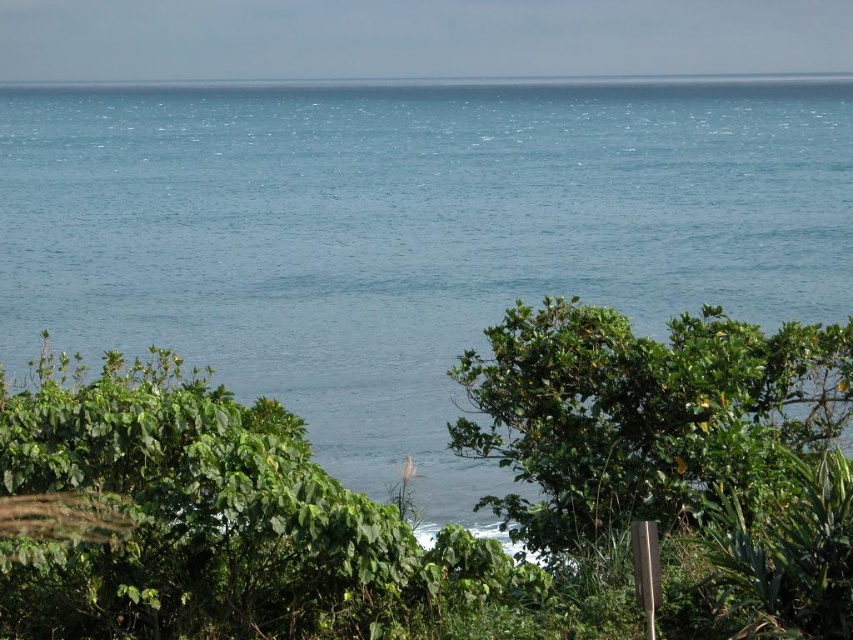
Question: Can you confirm if blue water at center is positioned above green leafy tree at center?

Choices:
 (A) yes
 (B) no

Answer: (A)

Question: Observing the image, what is the correct spatial positioning of blue water at center in reference to green leafy tree at center?

Choices:
 (A) left
 (B) right

Answer: (B)

Question: Which point is farther to the camera?

Choices:
 (A) (273, 385)
 (B) (746, 381)

Answer: (A)

Question: Can you confirm if blue water at center is wider than green leafy tree at center?

Choices:
 (A) yes
 (B) no

Answer: (A)